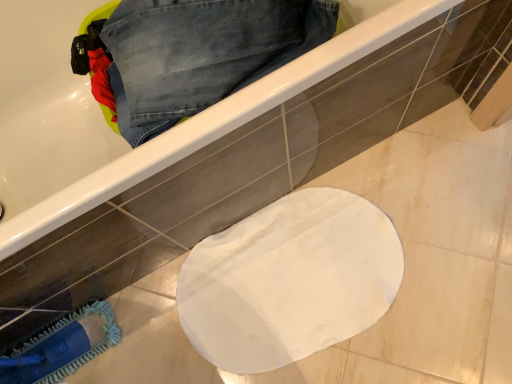
Identify the location of white glossy bathtub at upper center. The image size is (512, 384). (110, 128).

The height and width of the screenshot is (384, 512). What do you see at coordinates (110, 128) in the screenshot? I see `white glossy bathtub at upper center` at bounding box center [110, 128].

I want to click on blue fabric brush at lower left, so click(x=62, y=347).

The image size is (512, 384). I want to click on denim at upper left, so click(x=202, y=53).

Is white glossy bathtub at upper center inside the boundaries of blue fabric brush at lower left, or outside?

white glossy bathtub at upper center is spatially situated outside blue fabric brush at lower left.

Is there a large distance between white glossy bathtub at upper center and blue fabric brush at lower left?

That's not correct — white glossy bathtub at upper center is a little close to blue fabric brush at lower left.

Image resolution: width=512 pixels, height=384 pixels. I want to click on brush behind the white glossy bathtub at upper center, so pos(62,347).

Considering the positions of objects white glossy bathtub at upper center and blue fabric brush at lower left in the image provided, who is in front, white glossy bathtub at upper center or blue fabric brush at lower left?

Positioned in front is white glossy bathtub at upper center.

Find the location of a particular element. The width and height of the screenshot is (512, 384). bathtub to the left of denim at upper left is located at coordinates [110, 128].

Which is behind, white glossy bathtub at upper center or denim at upper left?

denim at upper left is behind.

From the image's perspective, between white glossy bathtub at upper center and denim at upper left, which one is located above?

denim at upper left.

Which object is wider, white glossy bathtub at upper center or denim at upper left?

Wider between the two is white glossy bathtub at upper center.

Considering the sizes of objects blue fabric brush at lower left and denim at upper left in the image provided, who is wider, blue fabric brush at lower left or denim at upper left?

With larger width is denim at upper left.

Is blue fabric brush at lower left facing away from denim at upper left?

No, blue fabric brush at lower left's orientation is not away from denim at upper left.

Is blue fabric brush at lower left at the left side of denim at upper left?

Correct, you'll find blue fabric brush at lower left to the left of denim at upper left.

Is blue fabric brush at lower left further to camera compared to denim at upper left?

Yes, blue fabric brush at lower left is further from the camera.

Considering the sizes of denim at upper left and blue fabric brush at lower left in the image, is denim at upper left taller or shorter than blue fabric brush at lower left?

Considering their sizes, denim at upper left has less height than blue fabric brush at lower left.

Which is in front, denim at upper left or blue fabric brush at lower left?

denim at upper left is closer to the camera.

Can you confirm if denim at upper left is positioned to the left of blue fabric brush at lower left?

No.

Where is `brush that appears below the denim at upper left (from a real-world perspective)`? The image size is (512, 384). brush that appears below the denim at upper left (from a real-world perspective) is located at coordinates (62, 347).

Which object is positioned more to the right, blue fabric brush at lower left or white glossy bathtub at upper center?

white glossy bathtub at upper center.

Is white glossy bathtub at upper center inside blue fabric brush at lower left?

No.

What's the angular difference between blue fabric brush at lower left and white glossy bathtub at upper center's facing directions?

The angle between the facing direction of blue fabric brush at lower left and the facing direction of white glossy bathtub at upper center is 90 degrees.

Is blue fabric brush at lower left thinner than white glossy bathtub at upper center?

Yes.

Is denim at upper left shorter than white glossy bathtub at upper center?

Yes.

Which is in front, denim at upper left or white glossy bathtub at upper center?

white glossy bathtub at upper center is closer to the camera.

Would you say denim at upper left is a long distance from white glossy bathtub at upper center?

No, there isn't a large distance between denim at upper left and white glossy bathtub at upper center.

Is denim at upper left smaller than white glossy bathtub at upper center?

Yes, denim at upper left is smaller than white glossy bathtub at upper center.

Locate an element on the screen. brush below the white glossy bathtub at upper center (from the image's perspective) is located at coordinates (62, 347).

Locate an element on the screen. The image size is (512, 384). trousers lying above the white glossy bathtub at upper center (from the image's perspective) is located at coordinates (202, 53).

Looking at the image, which one is located closer to blue fabric brush at lower left, denim at upper left or white glossy bathtub at upper center?

white glossy bathtub at upper center.

Considering their positions, is blue fabric brush at lower left positioned further to denim at upper left than white glossy bathtub at upper center?

Based on the image, blue fabric brush at lower left appears to be further to denim at upper left.

Which object lies further to the anchor point denim at upper left, white glossy bathtub at upper center or blue fabric brush at lower left?

blue fabric brush at lower left lies further to denim at upper left than the other object.

Considering their positions, is denim at upper left positioned further to white glossy bathtub at upper center than blue fabric brush at lower left?

Among the two, blue fabric brush at lower left is located further to white glossy bathtub at upper center.

Looking at this image, looking at the image, which one is located further to white glossy bathtub at upper center, blue fabric brush at lower left or denim at upper left?

blue fabric brush at lower left is further to white glossy bathtub at upper center.

When comparing their distances from blue fabric brush at lower left, does white glossy bathtub at upper center or denim at upper left seem closer?

Among the two, white glossy bathtub at upper center is located nearer to blue fabric brush at lower left.

Locate an element on the screen. This screenshot has width=512, height=384. bathtub between denim at upper left and blue fabric brush at lower left from top to bottom is located at coordinates (110, 128).